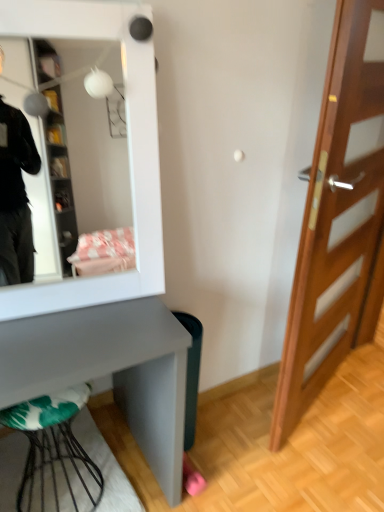
Question: Is green plastic trash bin at lower right located outside metallic wire stool at lower left?

Choices:
 (A) no
 (B) yes

Answer: (B)

Question: From the image's perspective, would you say green plastic trash bin at lower right is shown under metallic wire stool at lower left?

Choices:
 (A) no
 (B) yes

Answer: (A)

Question: From a real-world perspective, is green plastic trash bin at lower right positioned over metallic wire stool at lower left based on gravity?

Choices:
 (A) no
 (B) yes

Answer: (B)

Question: Is green plastic trash bin at lower right at the right side of metallic wire stool at lower left?

Choices:
 (A) yes
 (B) no

Answer: (A)

Question: Considering the relative positions of green plastic trash bin at lower right and metallic wire stool at lower left in the image provided, is green plastic trash bin at lower right to the left of metallic wire stool at lower left from the viewer's perspective?

Choices:
 (A) no
 (B) yes

Answer: (A)

Question: Is green plastic trash bin at lower right directly adjacent to metallic wire stool at lower left?

Choices:
 (A) yes
 (B) no

Answer: (B)

Question: Considering the relative positions of metallic wire stool at lower left and white glossy mirror at upper left in the image provided, is metallic wire stool at lower left in front of white glossy mirror at upper left?

Choices:
 (A) yes
 (B) no

Answer: (B)

Question: Is metallic wire stool at lower left at the left side of white glossy mirror at upper left?

Choices:
 (A) no
 (B) yes

Answer: (B)

Question: From the image's perspective, is metallic wire stool at lower left on top of white glossy mirror at upper left?

Choices:
 (A) no
 (B) yes

Answer: (A)

Question: Can you confirm if metallic wire stool at lower left is bigger than white glossy mirror at upper left?

Choices:
 (A) no
 (B) yes

Answer: (A)

Question: Does metallic wire stool at lower left come behind white glossy mirror at upper left?

Choices:
 (A) no
 (B) yes

Answer: (B)

Question: Could you tell me if metallic wire stool at lower left is turned towards white glossy mirror at upper left?

Choices:
 (A) no
 (B) yes

Answer: (A)

Question: From the image's perspective, is white glossy mirror at upper left below wooden door at right?

Choices:
 (A) yes
 (B) no

Answer: (B)